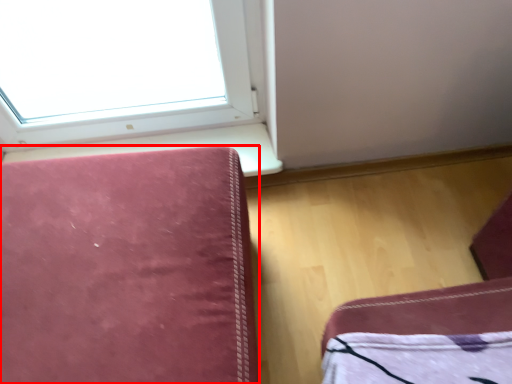
Question: From the image, what is the correct spatial relationship of furniture (annotated by the red box) in relation to window sill?

Choices:
 (A) left
 (B) right

Answer: (A)